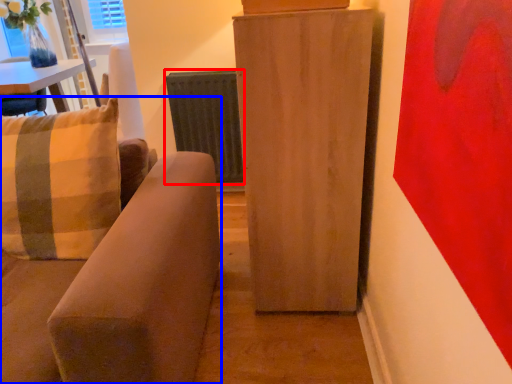
Question: Which object is closer to the camera taking this photo, radiator (highlighted by a red box) or studio couch (highlighted by a blue box)?

Choices:
 (A) radiator
 (B) studio couch

Answer: (B)